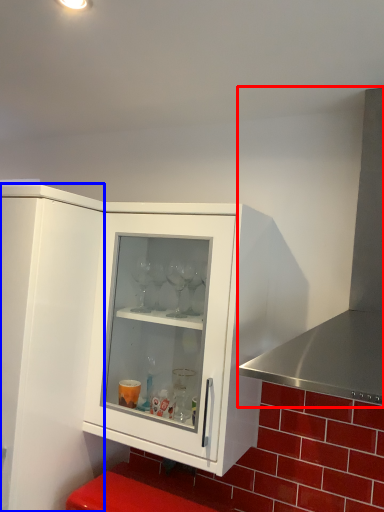
Question: Which of the following is the closest to the observer, exhaust hood (highlighted by a red box) or cupboard (highlighted by a blue box)?

Choices:
 (A) exhaust hood
 (B) cupboard

Answer: (A)